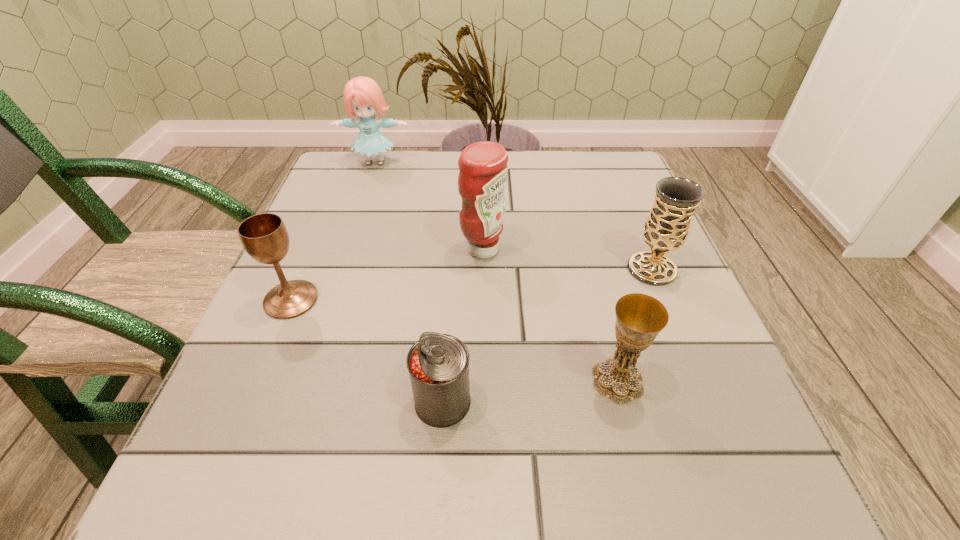
The width and height of the screenshot is (960, 540). Find the location of `vacant area that lies between the rightmost object and the condiment`. vacant area that lies between the rightmost object and the condiment is located at coordinates (567, 259).

Where is `free spot between the leftmost chalice and the shortest object`? This screenshot has height=540, width=960. free spot between the leftmost chalice and the shortest object is located at coordinates (367, 351).

I want to click on empty location between the leftmost chalice and the rightmost chalice, so click(x=471, y=285).

The image size is (960, 540). Identify the location of vacant space that is in between the second chalice from left to right and the condiment. (550, 315).

At what (x,y) coordinates should I click in order to perform the action: click on empty space that is in between the doll and the rightmost chalice. Please return your answer as a coordinate pair (x, y). The width and height of the screenshot is (960, 540). Looking at the image, I should click on (514, 216).

This screenshot has height=540, width=960. What are the coordinates of `empty location between the condiment and the fifth object from left to right` in the screenshot? It's located at (550, 315).

You are a GUI agent. You are given a task and a screenshot of the screen. Output one action in this format:
    pyautogui.click(x=<x>, y=<y>)
    Task: Click on the free spot between the can and the second object from right to left
    The image size is (960, 540).
    Given the screenshot: What is the action you would take?
    pyautogui.click(x=530, y=392)

The width and height of the screenshot is (960, 540). I want to click on free space between the condiment and the rightmost chalice, so click(567, 259).

At what (x,y) coordinates should I click in order to perform the action: click on free space between the can and the nearest chalice. Please return your answer as a coordinate pair (x, y). Looking at the image, I should click on (530, 392).

Identify the location of object that is the second closest to the rightmost chalice. (483, 173).